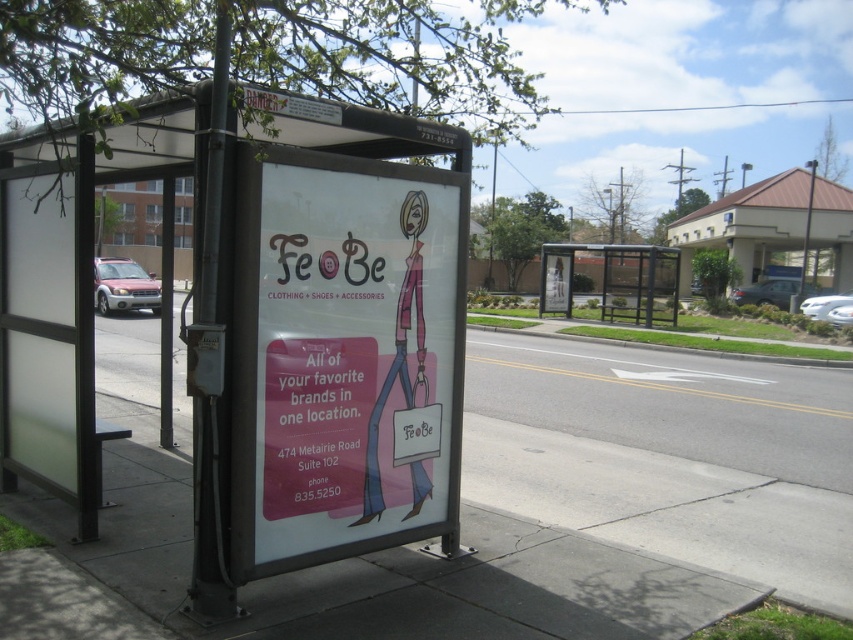
You are a pedestrian standing on the sidewalk and want to check the schedule at both the white frosted glass bus stop at left and the metallic silver bus stop at center. Which one do you need to walk towards first to reach the one that is physically above the other?

The white frosted glass bus stop at left is positioned under the metallic silver bus stop at center, so you should walk towards the metallic silver bus stop at center first as it is above the other one.

You are a pedestrian standing on the sidewalk and want to reach the bus stop. Which bus stop is closer to you, the white frosted glass bus stop at left or the metallic silver bus stop at center?

The white frosted glass bus stop at left is closer to you because it is in front of the metallic silver bus stop at center, meaning it is positioned closer to your current position on the sidewalk.

In the scene shown: You are a pedestrian standing on the sidewalk and want to read the matte pink poster at center. However, the white frosted glass bus stop at left is blocking your view. Can you move to the right to see the poster better?

The white frosted glass bus stop at left is positioned over matte pink poster at center, so moving to the right might help you see the poster better by moving out from under the bus stop.